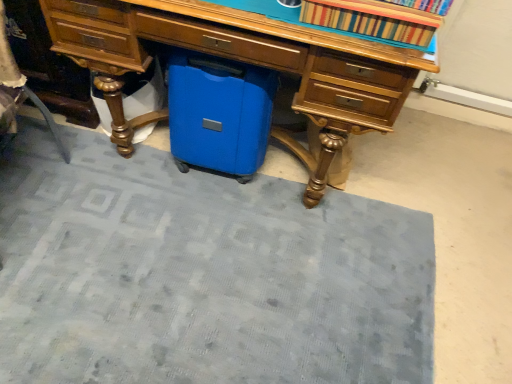
Question: Choose the correct answer: Is striped fabric book at upper center inside matte wood desk at center or outside it?

Choices:
 (A) outside
 (B) inside

Answer: (A)

Question: Relative to matte wood desk at center, is striped fabric book at upper center in front or behind?

Choices:
 (A) front
 (B) behind

Answer: (A)

Question: Estimate the real-world distances between objects in this image. Which object is closer to the matte wood desk at center?

Choices:
 (A) blue plastic suitcase at center
 (B) blue fabric doormat at lower center
 (C) striped fabric book at upper center

Answer: (A)

Question: Considering the real-world distances, which object is farthest from the blue fabric doormat at lower center?

Choices:
 (A) matte wood desk at center
 (B) blue plastic suitcase at center
 (C) striped fabric book at upper center

Answer: (C)